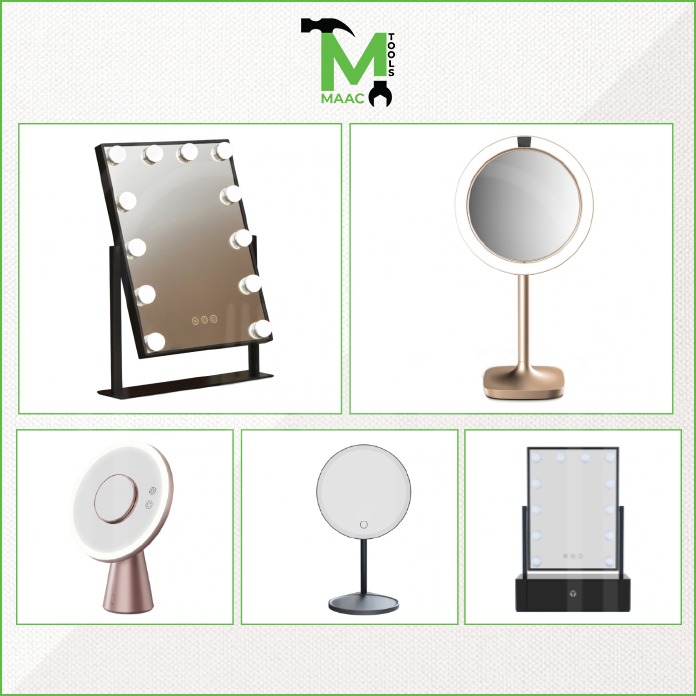
Image resolution: width=696 pixels, height=696 pixels. I want to click on round mirror, so click(x=355, y=488).